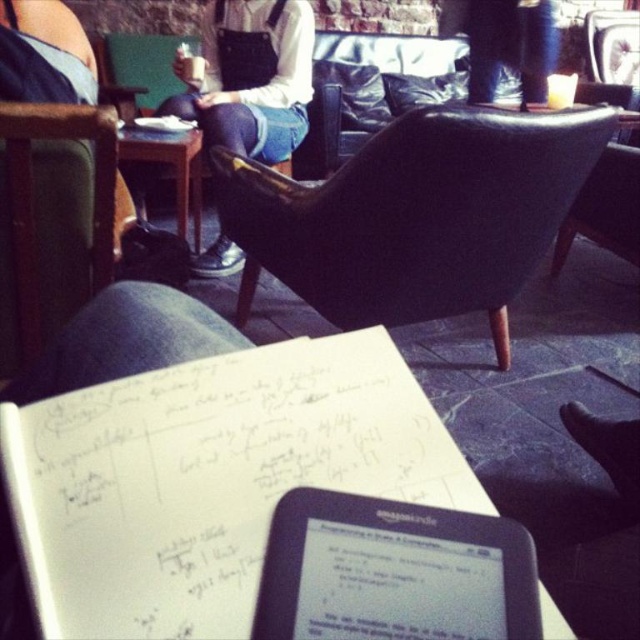
How far apart are black matte tablet at lower center and green fabric armchair at left?

black matte tablet at lower center is 38.22 inches away from green fabric armchair at left.

Looking at this image, is black matte tablet at lower center thinner than green fabric armchair at left?

Yes, black matte tablet at lower center is thinner than green fabric armchair at left.

Which is behind, point (531, 584) or point (36, 300)?

The point (36, 300) is more distant.

Where is `black matte tablet at lower center`? The height and width of the screenshot is (640, 640). black matte tablet at lower center is located at coordinates (394, 572).

Does point (161, 520) come in front of point (51, 108)?

Yes, it is.

Which is behind, point (148, 440) or point (54, 148)?

The point (54, 148) is behind.

This screenshot has height=640, width=640. I want to click on white paper at center, so click(x=211, y=477).

Where is `white paper at center`? This screenshot has height=640, width=640. white paper at center is located at coordinates (211, 477).

Can you confirm if white paper at center is taller than black matte tablet at lower center?

Yes.

Is point (240, 454) behind point (493, 630)?

Yes, point (240, 454) is farther from viewer.

At what (x,y) coordinates should I click in order to perform the action: click on white paper at center. Please return your answer as a coordinate pair (x, y). Image resolution: width=640 pixels, height=640 pixels. Looking at the image, I should click on (211, 477).